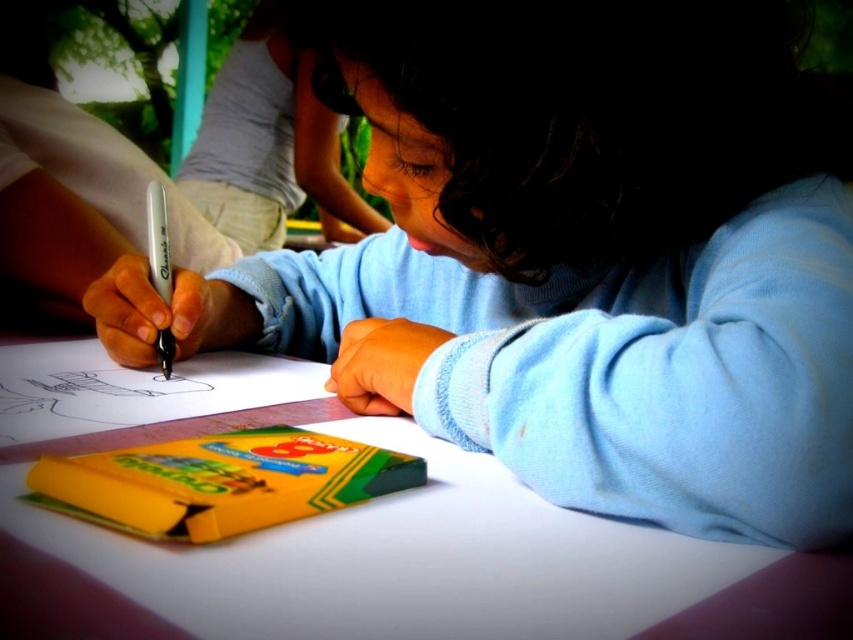
Based on the photo, is yellow cardboard coloring book at center taller than white matte pen at center?

In fact, yellow cardboard coloring book at center may be shorter than white matte pen at center.

Does yellow cardboard coloring book at center appear over white matte pen at center?

Actually, yellow cardboard coloring book at center is below white matte pen at center.

Where is `yellow cardboard coloring book at center`? yellow cardboard coloring book at center is located at coordinates (219, 481).

Does white paper at center have a larger size compared to yellow cardboard coloring book at center?

Yes.

Does white paper at center have a lesser width compared to yellow cardboard coloring book at center?

No, white paper at center is not thinner than yellow cardboard coloring book at center.

Does point (103, 577) come in front of point (264, 516)?

Yes, point (103, 577) is closer to viewer.

Locate an element on the screen. white paper at center is located at coordinates (399, 563).

Which is more to the left, white paper at center or white matte pen at center?

Positioned to the left is white matte pen at center.

Looking at this image, which of these two, white paper at center or white matte pen at center, stands shorter?

With less height is white paper at center.

Who is more distant from viewer, (358, 515) or (149, 220)?

The point (149, 220) is more distant.

Identify the location of white paper at center. The image size is (853, 640). (399, 563).